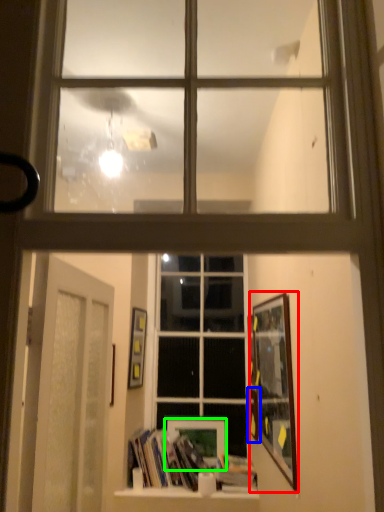
Question: Which is farther away from picture frame (highlighted by a red box)? picture frame (highlighted by a blue box) or picture frame (highlighted by a green box)?

Choices:
 (A) picture frame
 (B) picture frame

Answer: (B)